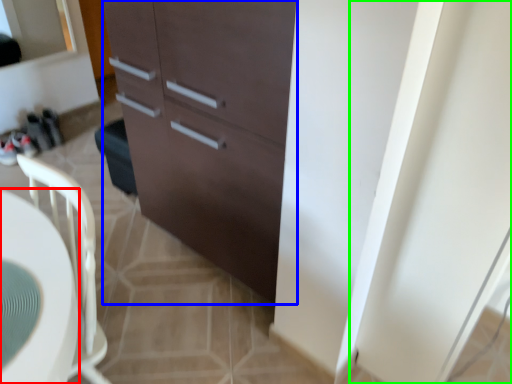
Question: Based on their relative distances, which object is farther from desk (highlighted by a red box)? Choose from cabinetry (highlighted by a blue box) and screen door (highlighted by a green box).

Choices:
 (A) cabinetry
 (B) screen door

Answer: (B)